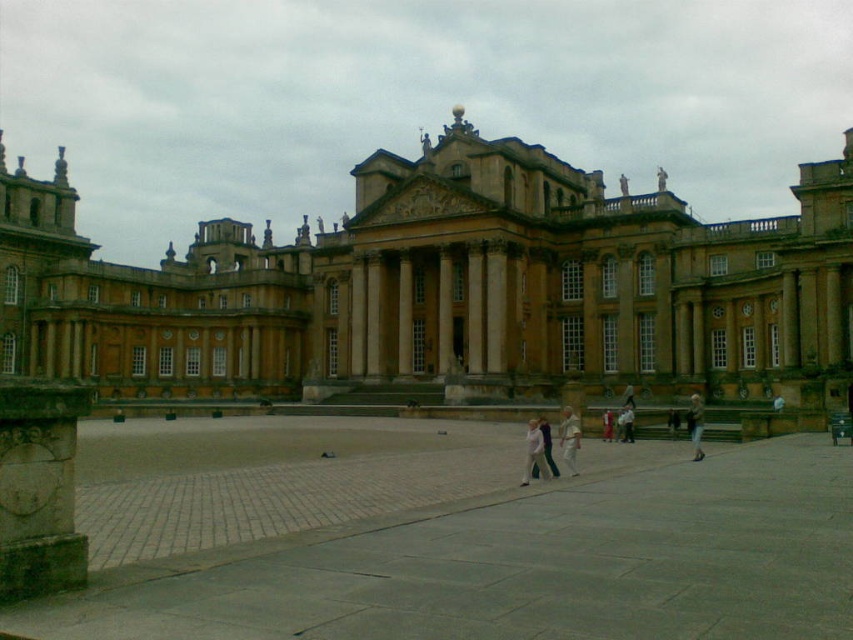
Question: In this image, where is golden stone palace at center located relative to sandy stone column at center?

Choices:
 (A) left
 (B) right

Answer: (A)

Question: Which object is positioned farthest from the smooth stone courtyard at center?

Choices:
 (A) light beige fabric pants at center
 (B) light brown leather jacket at lower right
 (C) sandy stone column at center

Answer: (C)

Question: Which of these objects is positioned farthest from the carved stone pillar at lower left?

Choices:
 (A) light brown leather jacket at center
 (B) light beige fabric person at center
 (C) golden stone palace at center
 (D) smooth stone courtyard at center

Answer: (A)

Question: Considering the real-world distances, which object is farthest from the carved stone pillar at lower left?

Choices:
 (A) light brown leather jacket at center
 (B) light purple fabric jacket at center

Answer: (A)

Question: Is carved stone pillar at lower left below light purple fabric jacket at center?

Choices:
 (A) yes
 (B) no

Answer: (B)

Question: In this image, where is smooth stone courtyard at center located relative to light beige fabric dress at center?

Choices:
 (A) above
 (B) below

Answer: (B)